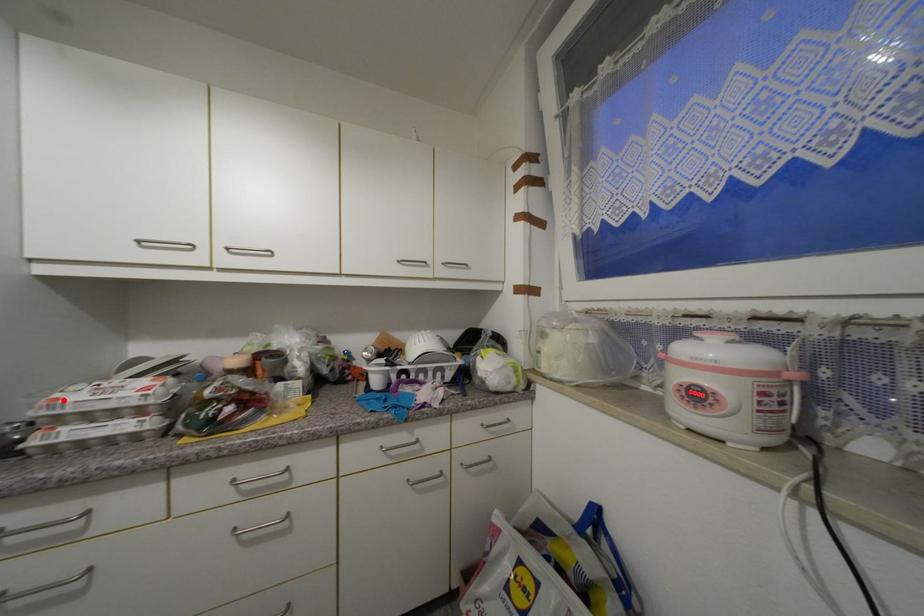
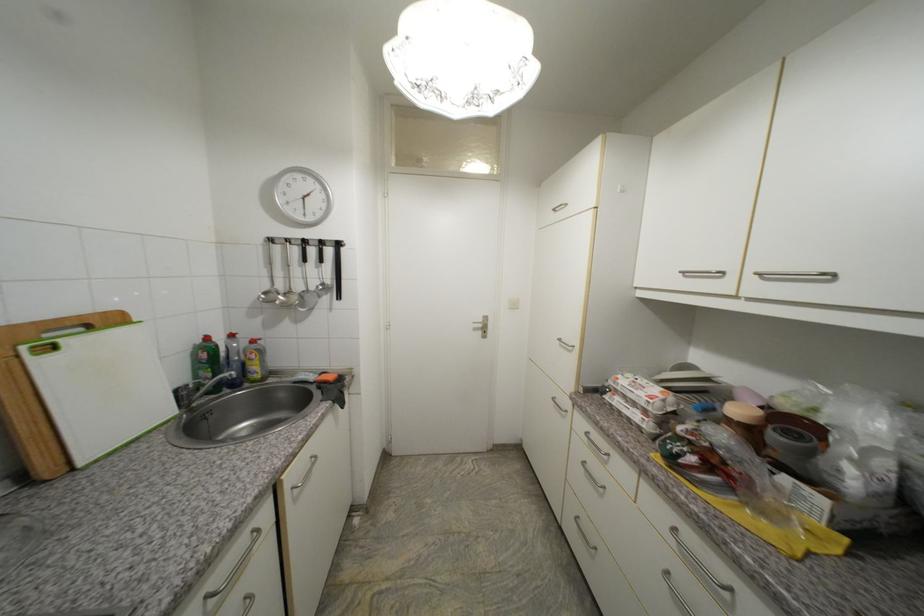
Where in the second image is the point corresponding to the highlighted location from the first image?

(623, 379)